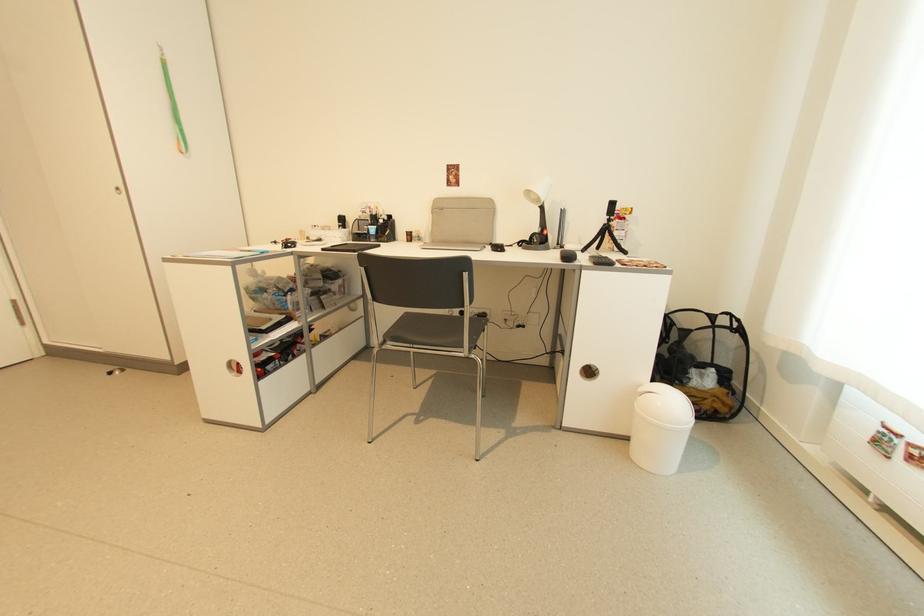
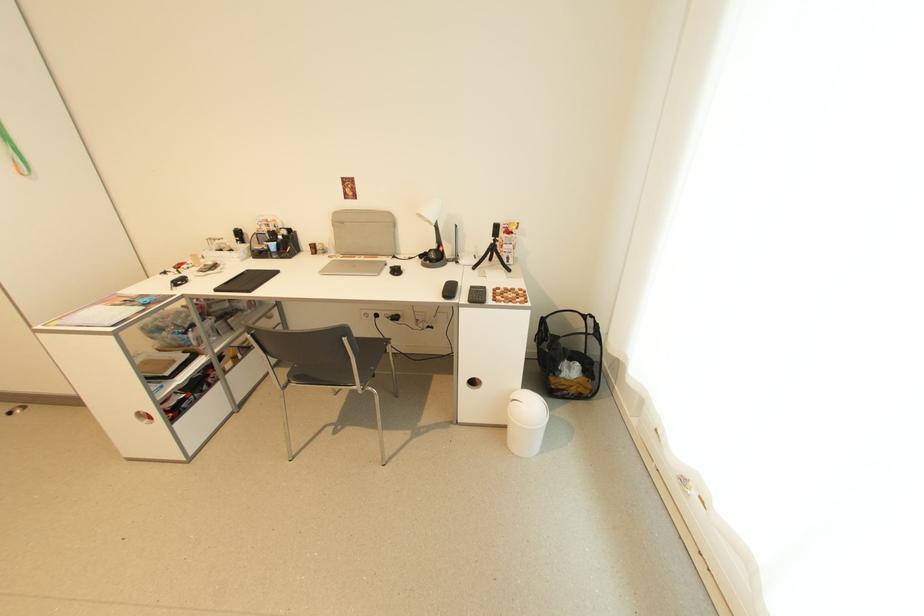
Find the pixel in the second image that matches (490,249) in the first image.

(391, 265)